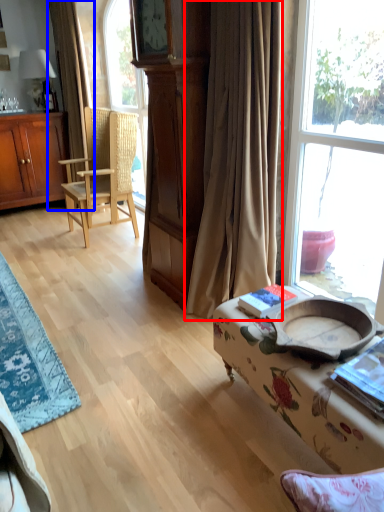
Question: Which of the following is the farthest to the observer, curtain (highlighted by a red box) or curtain (highlighted by a blue box)?

Choices:
 (A) curtain
 (B) curtain

Answer: (B)